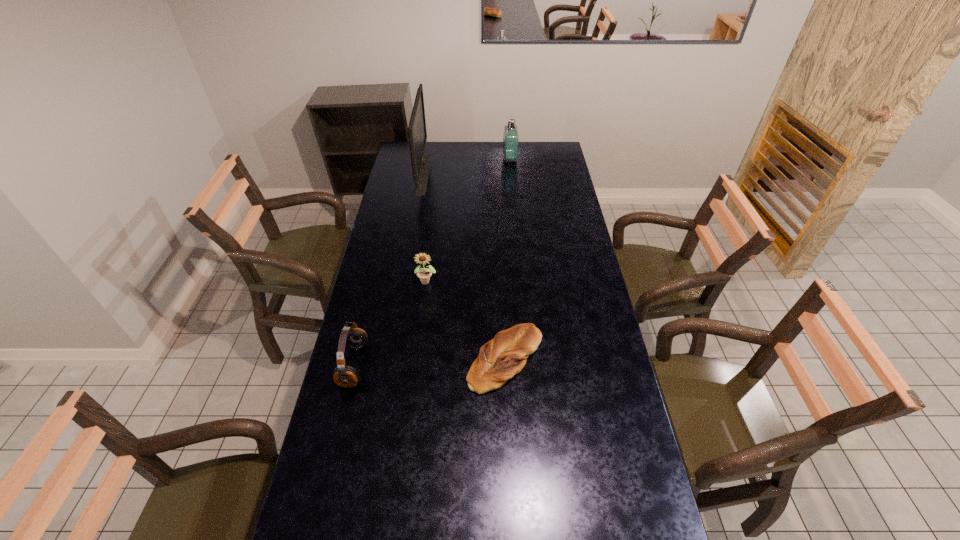
Locate an element on the screen. The height and width of the screenshot is (540, 960). blank area in the image that satisfies the following two spatial constraints: 1. on the front-facing side of the third object from left to right; 2. on the ear cups of the headset is located at coordinates (417, 366).

In order to click on vacant space that satisfies the following two spatial constraints: 1. on the front-facing side of the third farthest object; 2. on the ear cups of the headset in this screenshot , I will do `click(417, 366)`.